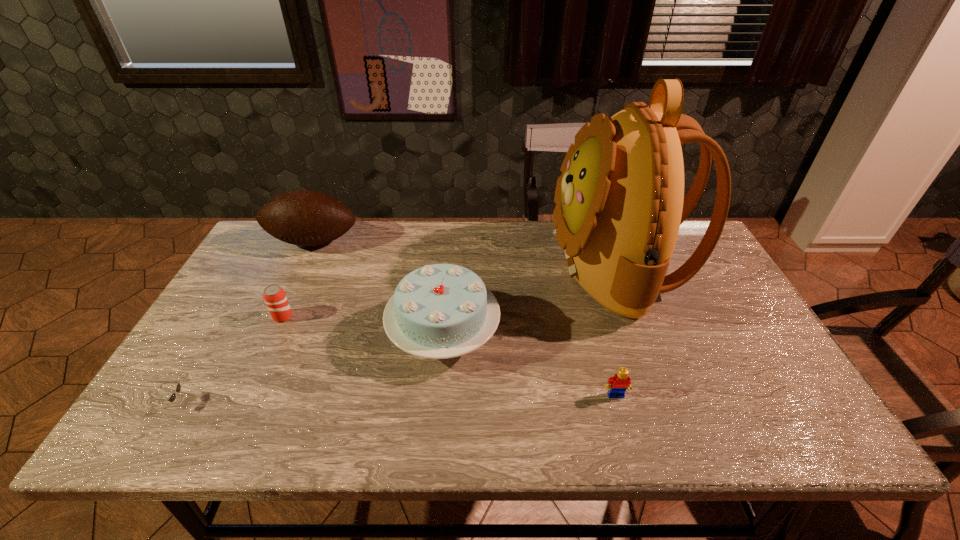
Where is `unoccupied area between the football and the backpack`? unoccupied area between the football and the backpack is located at coordinates (465, 255).

This screenshot has width=960, height=540. In order to click on unoccupied position between the shortest object and the beer can in this screenshot , I will do `click(228, 360)`.

Locate an element on the screen. This screenshot has width=960, height=540. unoccupied area between the tallest object and the third object from right to left is located at coordinates (530, 301).

Find the location of a particular element. The height and width of the screenshot is (540, 960). free point between the shortest object and the birthday cake is located at coordinates (308, 368).

Select which object is the second closest to the sunglasses. Please provide its 2D coordinates. Your answer should be formatted as a tuple, i.e. [(x, y)], where the tuple contains the x and y coordinates of a point satisfying the conditions above.

[(440, 311)]

Choose which object is the second nearest neighbor to the backpack. Please provide its 2D coordinates. Your answer should be formatted as a tuple, i.e. [(x, y)], where the tuple contains the x and y coordinates of a point satisfying the conditions above.

[(620, 382)]

Identify the location of vacant space that satisfies the following two spatial constraints: 1. on the laces of the beer can; 2. on the left side of the football. click(x=276, y=316).

Where is `vacant space that satisfies the following two spatial constraints: 1. on the laces of the football; 2. on the left side of the beer can`? The width and height of the screenshot is (960, 540). vacant space that satisfies the following two spatial constraints: 1. on the laces of the football; 2. on the left side of the beer can is located at coordinates (276, 316).

The height and width of the screenshot is (540, 960). I want to click on free space that satisfies the following two spatial constraints: 1. on the front-facing side of the tallest object; 2. on the front side of the birthday cake, so click(639, 333).

You are a GUI agent. You are given a task and a screenshot of the screen. Output one action in this format:
    pyautogui.click(x=<x>, y=<y>)
    Task: Click on the vacant point that satisfies the following two spatial constraints: 1. on the laces of the football; 2. in front of the lenses of the shortest object
    Image resolution: width=960 pixels, height=540 pixels.
    Given the screenshot: What is the action you would take?
    pyautogui.click(x=235, y=403)